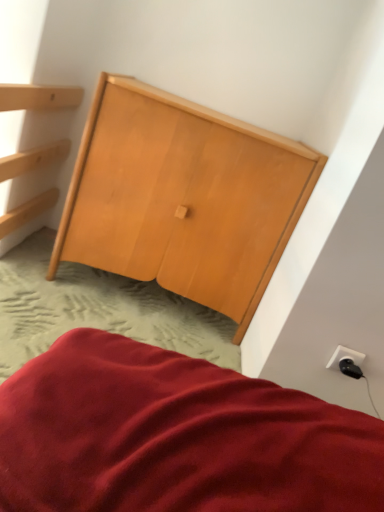
Question: Does natural wood wardrobe at center have a greater height compared to white plastic outlet at lower right?

Choices:
 (A) no
 (B) yes

Answer: (B)

Question: Are natural wood wardrobe at center and white plastic outlet at lower right making contact?

Choices:
 (A) no
 (B) yes

Answer: (A)

Question: From the image's perspective, is natural wood wardrobe at center located beneath white plastic outlet at lower right?

Choices:
 (A) yes
 (B) no

Answer: (B)

Question: Is natural wood wardrobe at center facing away from white plastic outlet at lower right?

Choices:
 (A) no
 (B) yes

Answer: (A)

Question: Is natural wood wardrobe at center further to the viewer compared to white plastic outlet at lower right?

Choices:
 (A) no
 (B) yes

Answer: (B)

Question: Can you confirm if natural wood wardrobe at center is wider than white plastic outlet at lower right?

Choices:
 (A) no
 (B) yes

Answer: (B)

Question: From a real-world perspective, is black plastic plug at lower right located beneath natural wood wardrobe at center?

Choices:
 (A) yes
 (B) no

Answer: (A)

Question: From a real-world perspective, is black plastic plug at lower right physically above natural wood wardrobe at center?

Choices:
 (A) no
 (B) yes

Answer: (A)

Question: Can you confirm if black plastic plug at lower right is positioned to the left of natural wood wardrobe at center?

Choices:
 (A) no
 (B) yes

Answer: (A)

Question: From the image's perspective, is black plastic plug at lower right under natural wood wardrobe at center?

Choices:
 (A) no
 (B) yes

Answer: (B)

Question: Can you confirm if black plastic plug at lower right is taller than natural wood wardrobe at center?

Choices:
 (A) yes
 (B) no

Answer: (B)

Question: Is there a large distance between black plastic plug at lower right and natural wood wardrobe at center?

Choices:
 (A) no
 (B) yes

Answer: (A)

Question: Is white plastic outlet at lower right a part of black plastic plug at lower right?

Choices:
 (A) yes
 (B) no

Answer: (B)